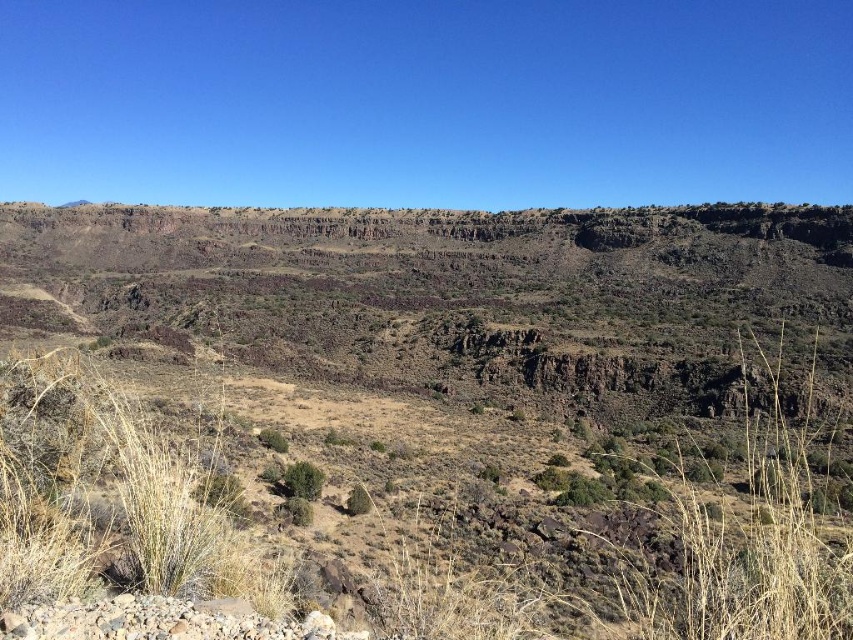
Question: Is the position of brown rocky cliffs at upper center less distant than that of green leafy bush at center?

Choices:
 (A) no
 (B) yes

Answer: (B)

Question: Which point appears farthest from the camera in this image?

Choices:
 (A) (302, 476)
 (B) (461, 212)

Answer: (B)

Question: Is brown rocky cliffs at upper center closer to camera compared to green leafy bush at center?

Choices:
 (A) no
 (B) yes

Answer: (B)

Question: Is brown rocky cliffs at upper center wider than green leafy bush at center?

Choices:
 (A) yes
 (B) no

Answer: (A)

Question: Which object appears closest to the camera in this image?

Choices:
 (A) brown rocky cliffs at upper center
 (B) green leafy bush at center

Answer: (A)